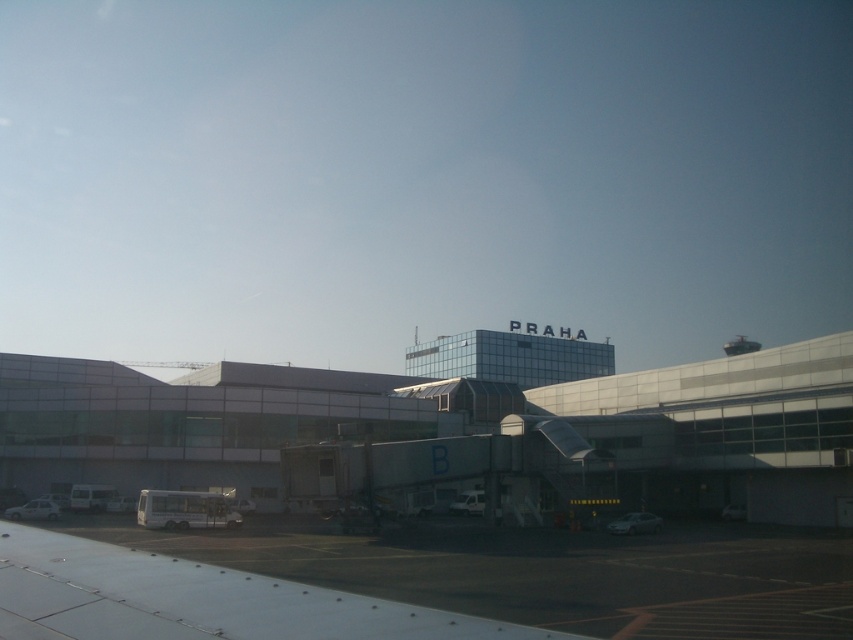
Question: Is glassy metallic airport terminal at center in front of white metallic wing at lower left?

Choices:
 (A) no
 (B) yes

Answer: (A)

Question: Where is glassy metallic airport terminal at center located in relation to white metallic wing at lower left in the image?

Choices:
 (A) above
 (B) below

Answer: (A)

Question: Does glassy metallic airport terminal at center have a smaller size compared to white metallic wing at lower left?

Choices:
 (A) yes
 (B) no

Answer: (B)

Question: Which of the following is the closest to the observer?

Choices:
 (A) (10, 528)
 (B) (846, 333)

Answer: (A)